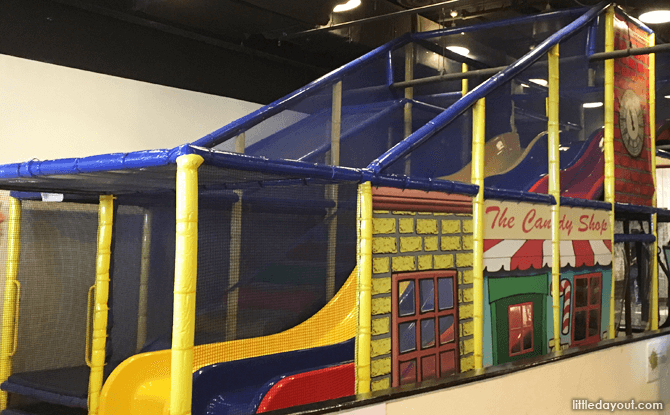
I want to click on lights, so click(656, 19), click(464, 45), click(352, 5), click(541, 79), click(590, 100).